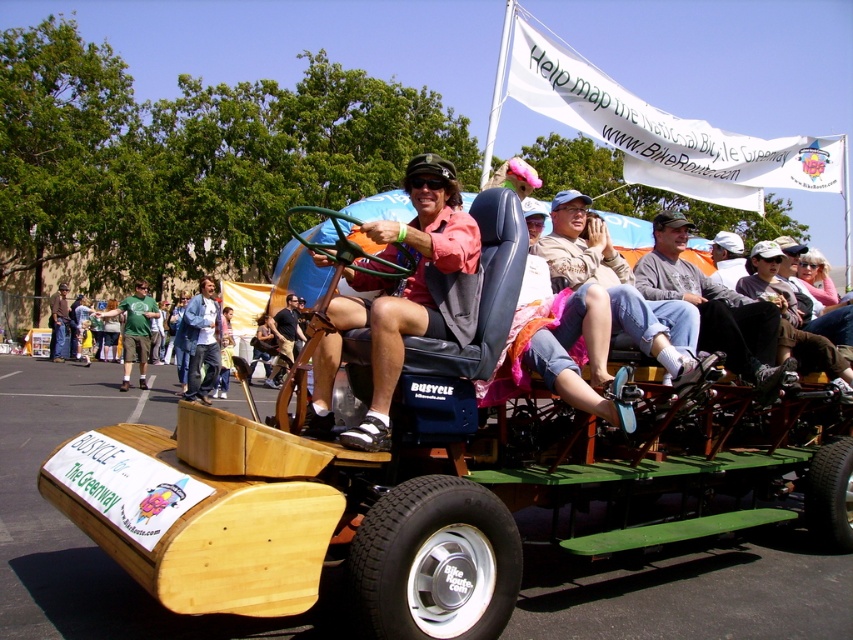
Between gray cotton shirt at center and denim jacket at center, which one has more height?

denim jacket at center is taller.

I want to click on gray cotton shirt at center, so click(712, 307).

Which is more to the right, denim jeans at center or denim jacket at center?

denim jeans at center

Which of these two, denim jeans at center or denim jacket at center, stands taller?

denim jacket at center

Which is behind, point (618, 282) or point (210, 352)?

The point (210, 352) is behind.

In order to click on denim jeans at center in this screenshot , I will do `click(618, 285)`.

Can you confirm if denim jeans at center is taller than gray cotton shirt at center?

No.

Locate an element on the screen. The image size is (853, 640). denim jeans at center is located at coordinates (618, 285).

Is point (693, 355) in front of point (659, 294)?

Yes, it is.

Locate an element on the screen. This screenshot has width=853, height=640. denim jeans at center is located at coordinates (x=618, y=285).